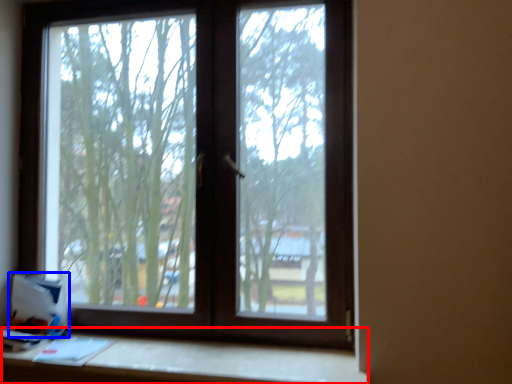
Question: Which point is further to the camera, table (highlighted by a red box) or cardboard box (highlighted by a blue box)?

Choices:
 (A) table
 (B) cardboard box

Answer: (B)